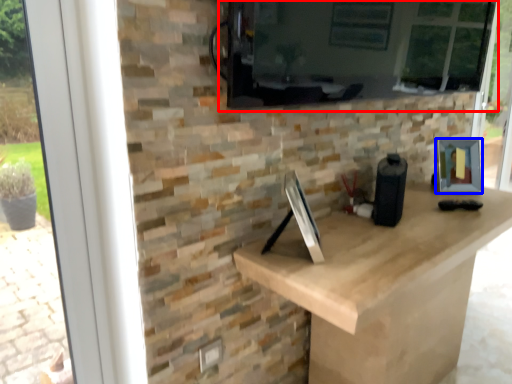
Question: Which of the following is the closest to the observer, window screen (highlighted by a red box) or picture frame (highlighted by a blue box)?

Choices:
 (A) window screen
 (B) picture frame

Answer: (A)